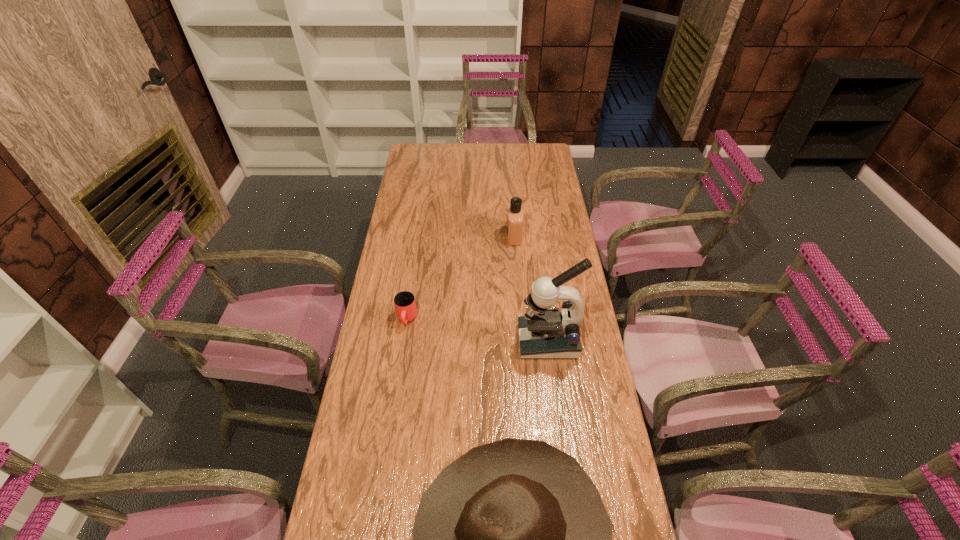
What are the coordinates of `vacant region that satisfies the following two spatial constraints: 1. on the front label of the perfume; 2. on the right side of the tallest object` in the screenshot? It's located at (522, 341).

In order to click on free location that satisfies the following two spatial constraints: 1. on the front label of the farthest object; 2. on the left side of the tallest object in this screenshot , I will do `click(522, 341)`.

You are a GUI agent. You are given a task and a screenshot of the screen. Output one action in this format:
    pyautogui.click(x=<x>, y=<y>)
    Task: Click on the vacant space that satisfies the following two spatial constraints: 1. on the front label of the perfume; 2. on the handle side of the leftmost object
    
    Given the screenshot: What is the action you would take?
    pyautogui.click(x=520, y=319)

Where is `vacant space that satisfies the following two spatial constraints: 1. on the front label of the farthest object; 2. on the right side of the microscope`? The width and height of the screenshot is (960, 540). vacant space that satisfies the following two spatial constraints: 1. on the front label of the farthest object; 2. on the right side of the microscope is located at coordinates (522, 341).